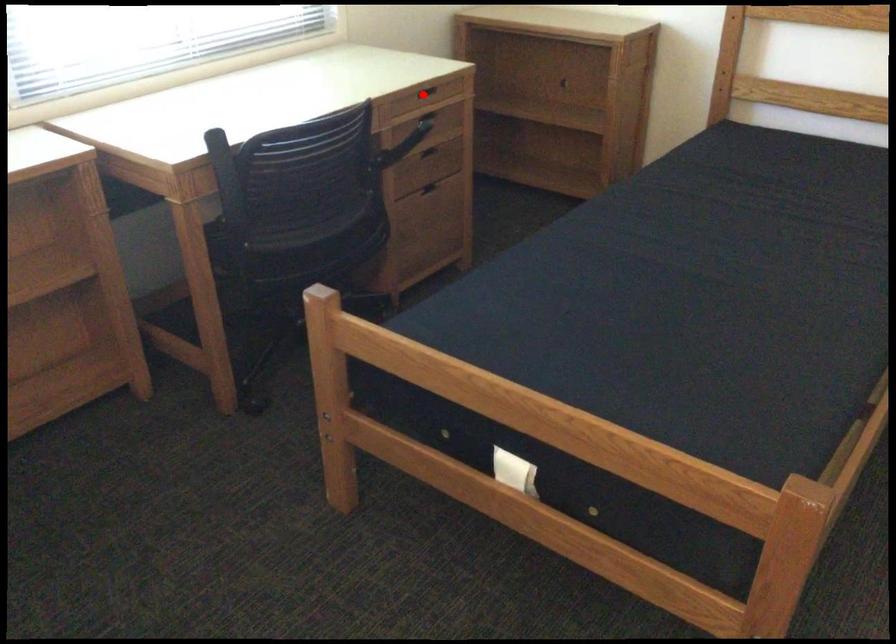
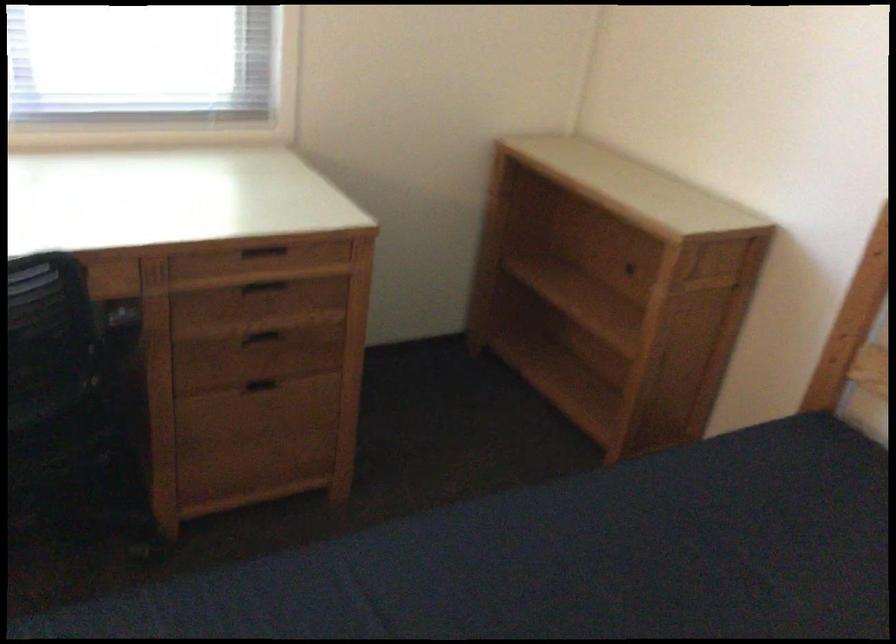
Question: I am providing you with two images of the same scene from different viewpoints. Given a red point in image1, look at the same physical point in image2. Is it:

Choices:
 (A) Closer to the viewpoint
 (B) Farther from the viewpoint

Answer: (A)